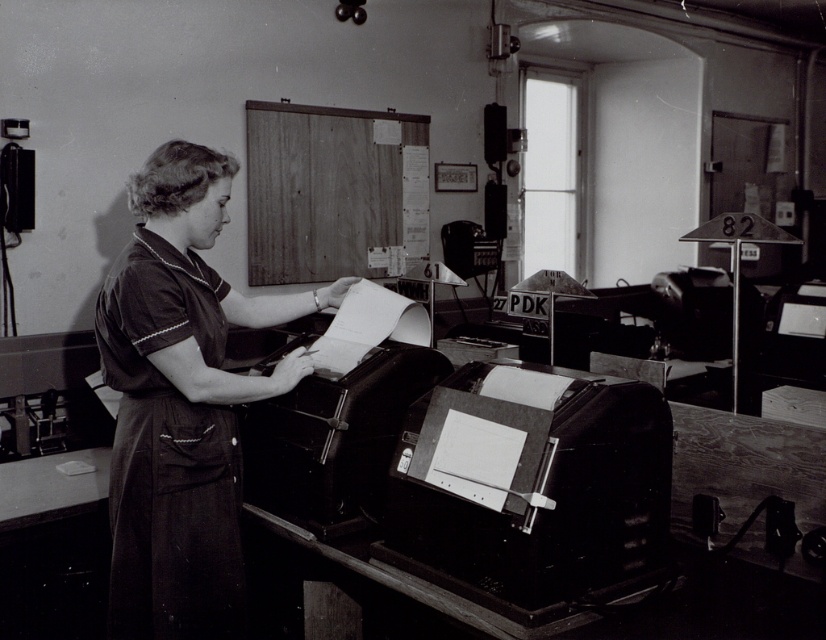
Question: Which point is farther to the camera?

Choices:
 (A) (390, 392)
 (B) (207, 381)

Answer: (A)

Question: Among these points, which one is nearest to the camera?

Choices:
 (A) (143, 486)
 (B) (229, 179)
 (C) (244, 440)
 (D) (580, 552)

Answer: (D)

Question: Is dark fabric apron at center bigger than metallic paper at center?

Choices:
 (A) no
 (B) yes

Answer: (A)

Question: Among these objects, which one is nearest to the camera?

Choices:
 (A) matte black dress at center
 (B) metallic paper at center

Answer: (A)

Question: Is matte black dress at center smaller than metallic paper at center?

Choices:
 (A) yes
 (B) no

Answer: (B)

Question: Observing the image, what is the correct spatial positioning of metallic black printer at lower center in reference to dark fabric apron at center?

Choices:
 (A) left
 (B) right

Answer: (B)